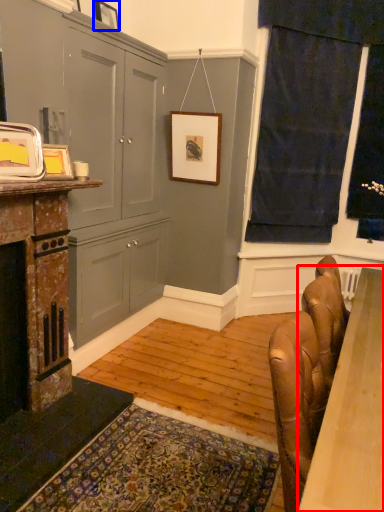
Question: Which point is closer to the camera, table (highlighted by a red box) or picture frame (highlighted by a blue box)?

Choices:
 (A) table
 (B) picture frame

Answer: (A)